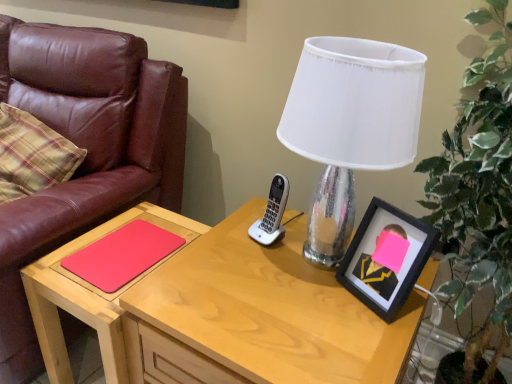
Question: Is clear glass lamp at center inside or outside of rubberized matte red notepad at lower left?

Choices:
 (A) inside
 (B) outside

Answer: (B)

Question: From the image's perspective, is clear glass lamp at center located above or below rubberized matte red notepad at lower left?

Choices:
 (A) below
 (B) above

Answer: (B)

Question: Considering the real-world distances, which object is closest to the clear glass lamp at center?

Choices:
 (A) matte wood desk at center
 (B) rubberized matte red notepad at lower left
 (C) black matte picture frame at right
 (D) green leafy plant at right
 (E) matte wood table at lower left

Answer: (C)

Question: Estimate the real-world distances between objects in this image. Which object is closer to the clear glass lamp at center?

Choices:
 (A) green leafy plant at right
 (B) matte brown leather chair at left
 (C) matte wood desk at center
 (D) rubberized matte red notepad at lower left
 (E) black matte picture frame at right

Answer: (E)